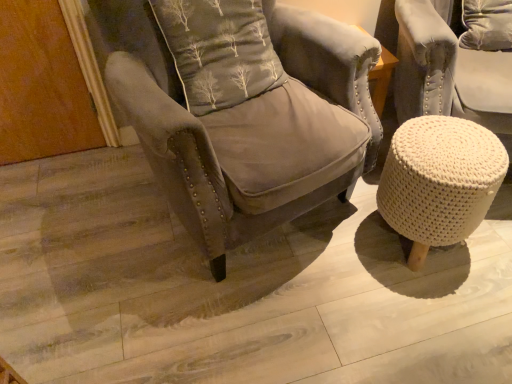
Question: Could gray fabric pillow at center be considered to be inside velvet gray armchair at center?

Choices:
 (A) yes
 (B) no

Answer: (A)

Question: Are velvet gray armchair at center and gray fabric pillow at center located far from each other?

Choices:
 (A) yes
 (B) no

Answer: (B)

Question: Is velvet gray armchair at center positioned with its back to gray fabric pillow at center?

Choices:
 (A) yes
 (B) no

Answer: (A)

Question: From the image's perspective, does velvet gray armchair at center appear higher than gray fabric pillow at center?

Choices:
 (A) no
 (B) yes

Answer: (A)

Question: Are velvet gray armchair at center and gray fabric pillow at center beside each other?

Choices:
 (A) no
 (B) yes

Answer: (A)

Question: From a real-world perspective, is velvet gray armchair at center located higher than gray fabric pillow at center?

Choices:
 (A) yes
 (B) no

Answer: (B)

Question: Considering the relative sizes of white knitted stool at lower right and gray fabric pillow at center in the image provided, is white knitted stool at lower right shorter than gray fabric pillow at center?

Choices:
 (A) no
 (B) yes

Answer: (B)

Question: Does white knitted stool at lower right have a greater height compared to gray fabric pillow at center?

Choices:
 (A) no
 (B) yes

Answer: (A)

Question: Is the position of white knitted stool at lower right more distant than that of gray fabric pillow at center?

Choices:
 (A) no
 (B) yes

Answer: (B)

Question: From the image's perspective, is white knitted stool at lower right below gray fabric pillow at center?

Choices:
 (A) yes
 (B) no

Answer: (A)

Question: Would you say gray fabric pillow at center is part of white knitted stool at lower right's contents?

Choices:
 (A) yes
 (B) no

Answer: (B)

Question: Does white knitted stool at lower right have a larger size compared to gray fabric pillow at center?

Choices:
 (A) no
 (B) yes

Answer: (A)

Question: Does velvet gray armchair at center appear on the left side of white knitted stool at lower right?

Choices:
 (A) no
 (B) yes

Answer: (B)